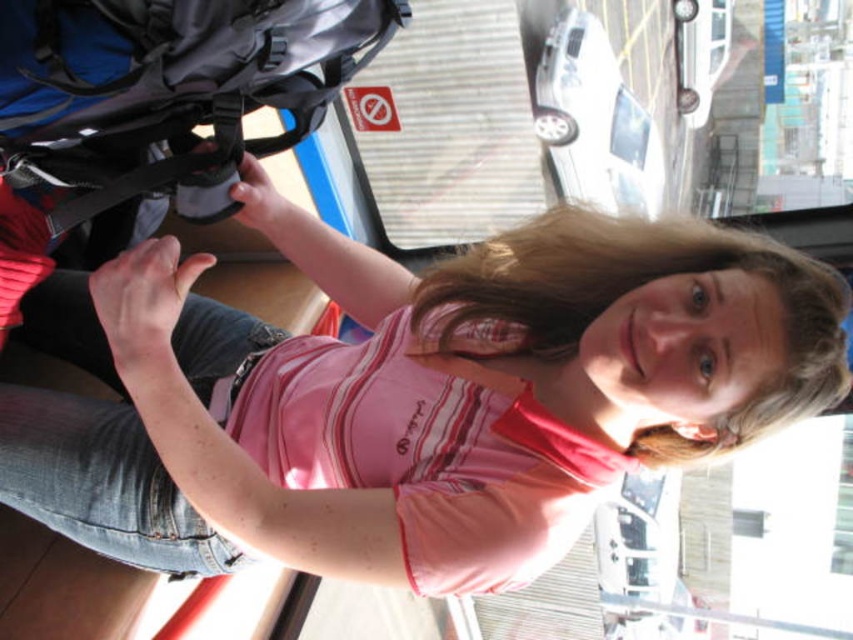
Image resolution: width=853 pixels, height=640 pixels. Find the location of `pink cotton shirt at center`. pink cotton shirt at center is located at coordinates (410, 394).

Is point (666, 300) farther from camera compared to point (24, 77)?

Yes, point (666, 300) is behind point (24, 77).

Where is `pink cotton shirt at center`? pink cotton shirt at center is located at coordinates (410, 394).

Image resolution: width=853 pixels, height=640 pixels. I want to click on pink cotton shirt at center, so click(410, 394).